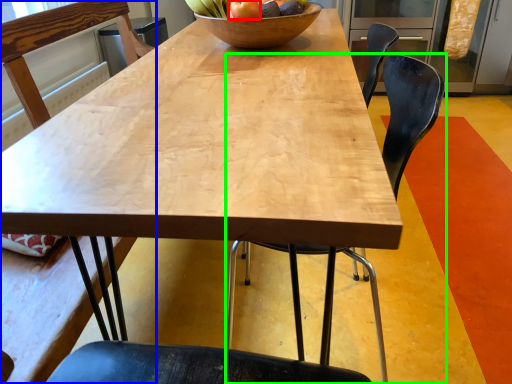
Question: Which is nearer to the apple (highlighted by a red box)? chair (highlighted by a blue box) or chair (highlighted by a green box).

Choices:
 (A) chair
 (B) chair

Answer: (B)